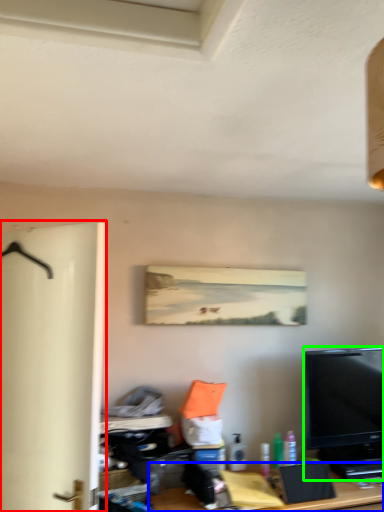
Question: Estimate the real-world distances between objects in this image. Which object is farther from door (highlighted by a red box), desk (highlighted by a blue box) or television (highlighted by a green box)?

Choices:
 (A) desk
 (B) television

Answer: (B)